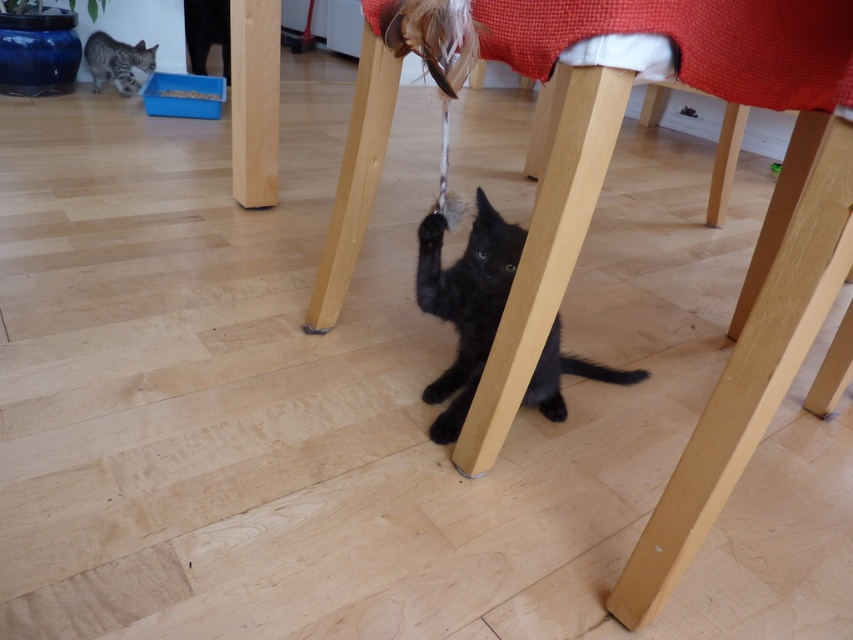
You are a small toy mouse. You want to roll from the wooden chair at center to the black matte fur cat at lower center. Can you reach the cat without going under the chair?

The wooden chair at center is in front of the black matte fur cat at lower center, so the mouse can roll around the chair to reach the cat without needing to go under it.

Based on the scene description, what are the coordinates of the wooden chair at center?

The wooden chair at center is located at coordinates point (753,278).